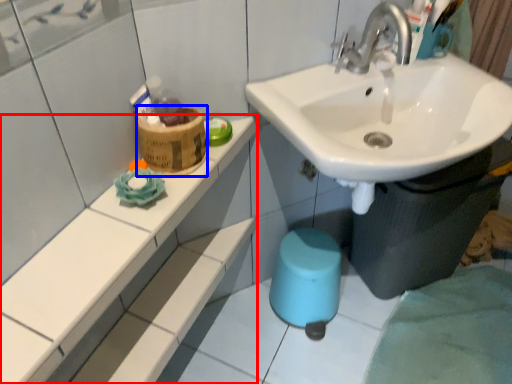
Question: Which point is closer to the camera, counter top (highlighted by a red box) or potty (highlighted by a blue box)?

Choices:
 (A) counter top
 (B) potty

Answer: (A)